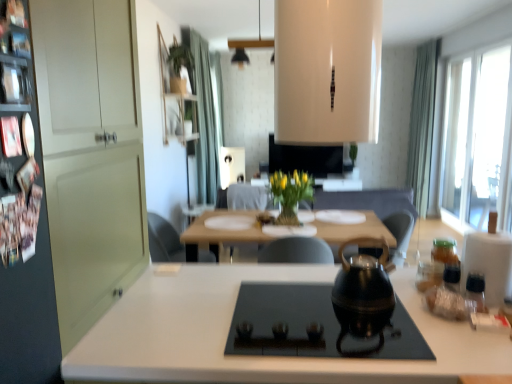
Question: In terms of size, does transparent plastic jar at right, acting as the first bottle starting from the back, appear bigger or smaller than wooden table at center?

Choices:
 (A) big
 (B) small

Answer: (B)

Question: From a real-world perspective, is transparent plastic jar at right, the 3th bottle positioned from the front, positioned above or below wooden table at center?

Choices:
 (A) above
 (B) below

Answer: (A)

Question: Which object is positioned farthest from the translucent glass jar at right, arranged as the 2th bottle when viewed from the front?

Choices:
 (A) black glass cooktop at center
 (B) wooden table at center
 (C) clear glass vase at center
 (D) metallic silver shelf at upper left
 (E) transparent plastic bottle at right, which ranks as the first bottle in front-to-back order

Answer: (C)

Question: Which object is the closest to the green fabric curtain at upper center, acting as the second curtain starting from the right?

Choices:
 (A) yellow matte vase at center
 (B) green fabric curtain at upper right, which appears as the 2th curtain when viewed from the left
 (C) transparent plastic jar at right, the 3th bottle positioned from the front
 (D) translucent glass jar at right, which appears as the second bottle when viewed from the back
 (E) transparent glass window at right

Answer: (A)